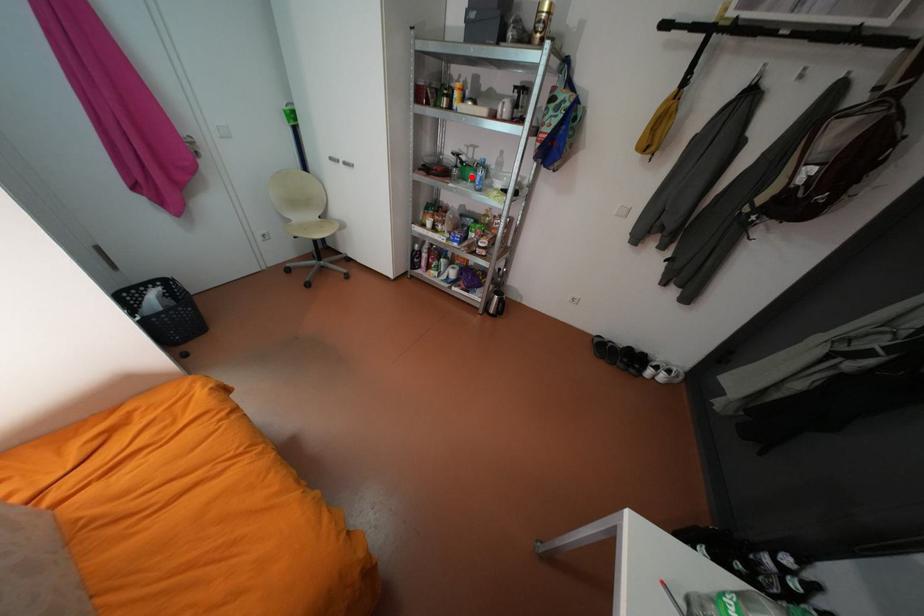
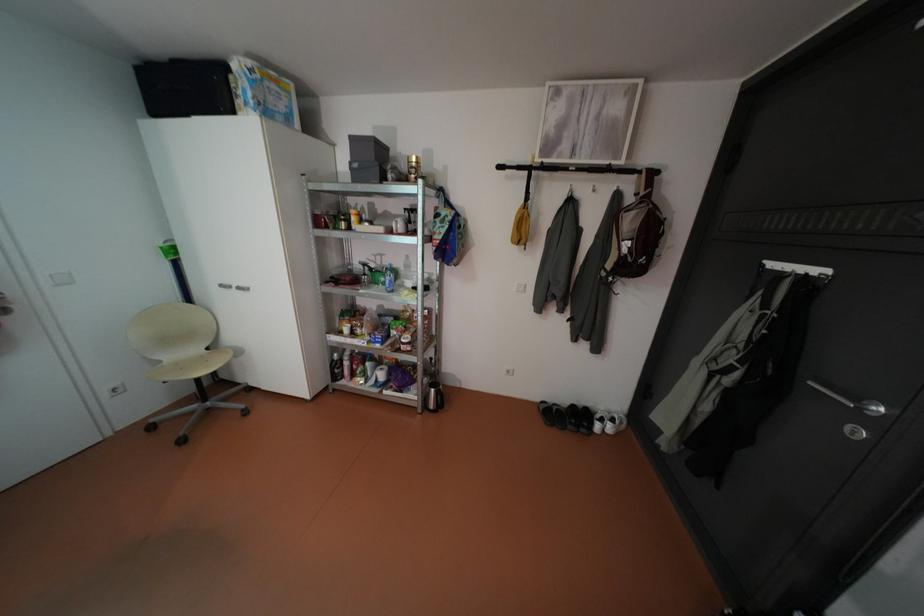
Where in the second image is the point corresponding to the highlighted location from the first image?

(383, 282)